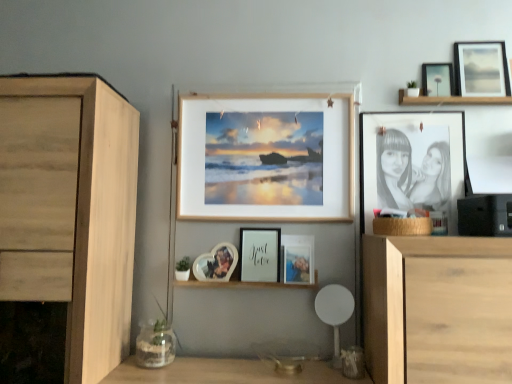
Question: Is clear glass vase at lower left bigger or smaller than light wood cabinet at left?

Choices:
 (A) small
 (B) big

Answer: (A)

Question: Considering the positions of clear glass vase at lower left and light wood cabinet at left in the image, is clear glass vase at lower left taller or shorter than light wood cabinet at left?

Choices:
 (A) short
 (B) tall

Answer: (A)

Question: Considering the real-world distances, which object is closest to the matte wooden picture frame at upper right, marked as the 7th picture frame in a left-to-right arrangement?

Choices:
 (A) matte black frame at center, which is counted as the 6th picture frame, starting from the right
 (B) matte glass photo frame at center, which appears as the seventh picture frame when viewed from the right
 (C) matte black photo frame at center, positioned as the 4th picture frame in left-to-right order
 (D) black paper photo frame at right, the 5th picture frame in the left-to-right sequence
 (E) light wood cabinet at left

Answer: (D)

Question: Which of these objects is positioned farthest from the matte black picture frame at upper right, the 6th picture frame in the left-to-right sequence?

Choices:
 (A) clear glass vase at lower left
 (B) white plastic chair at lower center
 (C) matte wooden picture frame at upper right, the 1th picture frame when ordered from right to left
 (D) matte glass photo frame at center, which appears as the seventh picture frame when viewed from the right
 (E) light wood cabinet at left

Answer: (A)